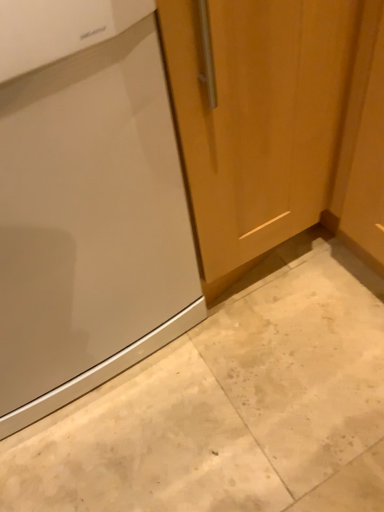
The width and height of the screenshot is (384, 512). Describe the element at coordinates (256, 116) in the screenshot. I see `matte wood door at center` at that location.

Where is `matte wood door at center`? This screenshot has width=384, height=512. matte wood door at center is located at coordinates (256, 116).

Are matte wood door at center and satin finish refrigerator at left beside each other?

No, matte wood door at center is not making contact with satin finish refrigerator at left.

Who is shorter, matte wood door at center or satin finish refrigerator at left?

Standing shorter between the two is matte wood door at center.

Locate an element on the screen. The height and width of the screenshot is (512, 384). home appliance in front of the matte wood door at center is located at coordinates (87, 206).

Is matte wood door at center aimed at satin finish refrigerator at left?

No, matte wood door at center is not oriented towards satin finish refrigerator at left.

Could you tell me if beige marble floor at lower left is facing matte wood door at center?

Yes, beige marble floor at lower left faces towards matte wood door at center.

Considering the relative sizes of beige marble floor at lower left and matte wood door at center in the image provided, is beige marble floor at lower left thinner than matte wood door at center?

Indeed, beige marble floor at lower left has a lesser width compared to matte wood door at center.

Is beige marble floor at lower left to the right of matte wood door at center from the viewer's perspective?

Correct, you'll find beige marble floor at lower left to the right of matte wood door at center.

Which object is more forward, beige marble floor at lower left or matte wood door at center?

beige marble floor at lower left.

Does satin finish refrigerator at left lie behind matte wood door at center?

No, the depth of satin finish refrigerator at left is less than that of matte wood door at center.

Identify the location of door behind the satin finish refrigerator at left. (256, 116).

Which is closer, (98, 168) or (210, 186)?

The point (98, 168) is closer to the camera.

Considering the positions of objects satin finish refrigerator at left and beige marble floor at lower left in the image provided, who is more to the left, satin finish refrigerator at left or beige marble floor at lower left?

satin finish refrigerator at left.

Is satin finish refrigerator at left not near beige marble floor at lower left?

No, satin finish refrigerator at left is not far away from beige marble floor at lower left.

This screenshot has width=384, height=512. In order to click on home appliance located on the left of beige marble floor at lower left in this screenshot , I will do `click(87, 206)`.

In the scene shown: From the image's perspective, is satin finish refrigerator at left above or below beige marble floor at lower left?

Clearly, from the image's perspective, satin finish refrigerator at left is below beige marble floor at lower left.

At what (x,y) coordinates should I click in order to perform the action: click on concrete lying below the matte wood door at center (from the image's perspective). Please return your answer as a coordinate pair (x, y). Looking at the image, I should click on (229, 410).

Is matte wood door at center positioned in front of beige marble floor at lower left?

That is False.

Is point (267, 178) more distant than point (363, 350)?

No, (267, 178) is closer to viewer.

Is beige marble floor at lower left oriented towards satin finish refrigerator at left?

Yes, beige marble floor at lower left is oriented towards satin finish refrigerator at left.

Is beige marble floor at lower left touching satin finish refrigerator at left?

No.

This screenshot has height=512, width=384. In order to click on door that appears above the satin finish refrigerator at left (from a real-world perspective) in this screenshot , I will do `click(256, 116)`.

Image resolution: width=384 pixels, height=512 pixels. Identify the location of door above the beige marble floor at lower left (from the image's perspective). (256, 116).

Which object lies further to the anchor point matte wood door at center, satin finish refrigerator at left or beige marble floor at lower left?

beige marble floor at lower left.

Which object lies nearer to the anchor point satin finish refrigerator at left, beige marble floor at lower left or matte wood door at center?

The object closer to satin finish refrigerator at left is matte wood door at center.

From the image, which object appears to be nearer to beige marble floor at lower left, satin finish refrigerator at left or matte wood door at center?

The object closer to beige marble floor at lower left is satin finish refrigerator at left.

Which object lies nearer to the anchor point satin finish refrigerator at left, matte wood door at center or beige marble floor at lower left?

matte wood door at center is closer to satin finish refrigerator at left.

When comparing their distances from beige marble floor at lower left, does matte wood door at center or satin finish refrigerator at left seem closer?

satin finish refrigerator at left is positioned closer to the anchor beige marble floor at lower left.

Looking at the image, which one is located closer to matte wood door at center, beige marble floor at lower left or satin finish refrigerator at left?

satin finish refrigerator at left.

I want to click on door between satin finish refrigerator at left and beige marble floor at lower left, so click(x=256, y=116).